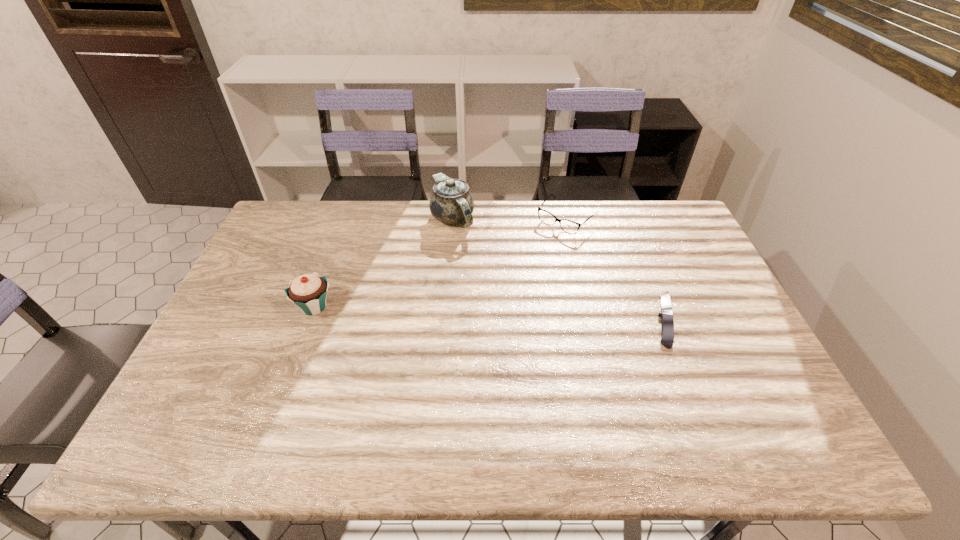
Find the location of a particular element. the leftmost object is located at coordinates (308, 291).

Locate an element on the screen. the second tallest object is located at coordinates (308, 291).

Identify the location of the rightmost object. (667, 323).

Locate an element on the screen. The image size is (960, 540). the shortest object is located at coordinates (667, 323).

Locate an element on the screen. This screenshot has width=960, height=540. the tallest object is located at coordinates 451,202.

Locate an element on the screen. The image size is (960, 540). the third object from right to left is located at coordinates (451, 202).

Where is `the third object from left to right`? the third object from left to right is located at coordinates (568, 226).

Find the location of a particular element. Image resolution: width=960 pixels, height=540 pixels. the second shortest object is located at coordinates (568, 226).

Where is `vacant region located on the front of the second tallest object`? The width and height of the screenshot is (960, 540). vacant region located on the front of the second tallest object is located at coordinates (298, 352).

Locate an element on the screen. free space located on the back of the shortest object is located at coordinates (638, 251).